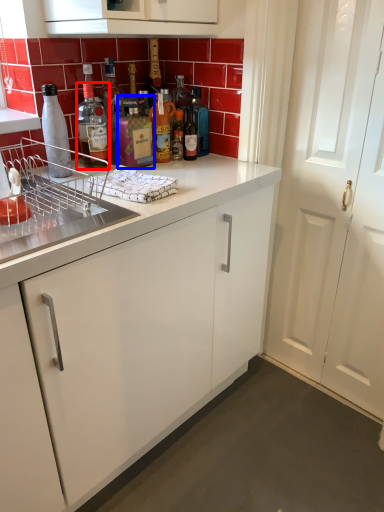
Question: Which of the following is the farthest to the observer, bottle (highlighted by a red box) or bottle (highlighted by a blue box)?

Choices:
 (A) bottle
 (B) bottle

Answer: (A)